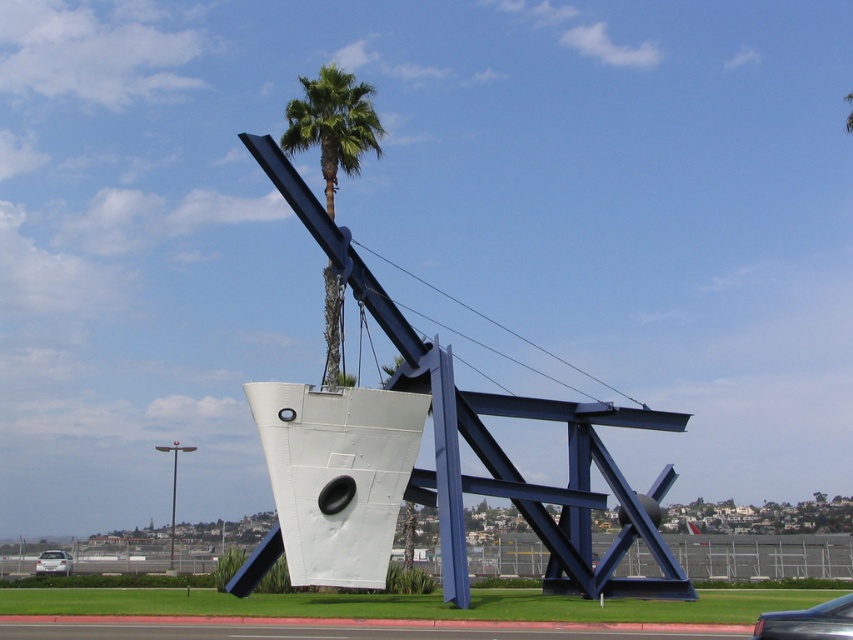
Which is below, metallic blue car at center or white glossy car at lower left?

Positioned lower is white glossy car at lower left.

How distant is metallic blue car at center from white glossy car at lower left?

The distance of metallic blue car at center from white glossy car at lower left is 42.87 meters.

Is point (761, 621) closer to viewer compared to point (47, 564)?

Yes, point (761, 621) is in front of point (47, 564).

The width and height of the screenshot is (853, 640). Identify the location of metallic blue car at center. (808, 621).

Is green leafy palm tree at upper center above white glossy car at lower left?

Yes.

Is green leafy palm tree at upper center thinner than white glossy car at lower left?

Incorrect, green leafy palm tree at upper center's width is not less than white glossy car at lower left's.

Who is more distant from viewer, (331, 180) or (44, 572)?

Positioned behind is point (44, 572).

Image resolution: width=853 pixels, height=640 pixels. In order to click on green leafy palm tree at upper center in this screenshot , I will do `click(334, 125)`.

Between green leafy palm tree at upper center and metallic blue car at center, which one has more height?

green leafy palm tree at upper center is taller.

Is point (368, 109) positioned after point (804, 611)?

Yes, it is.

Does point (370, 93) come in front of point (799, 632)?

No, (370, 93) is further to viewer.

Where is `green leafy palm tree at upper center`? Image resolution: width=853 pixels, height=640 pixels. green leafy palm tree at upper center is located at coordinates (334, 125).